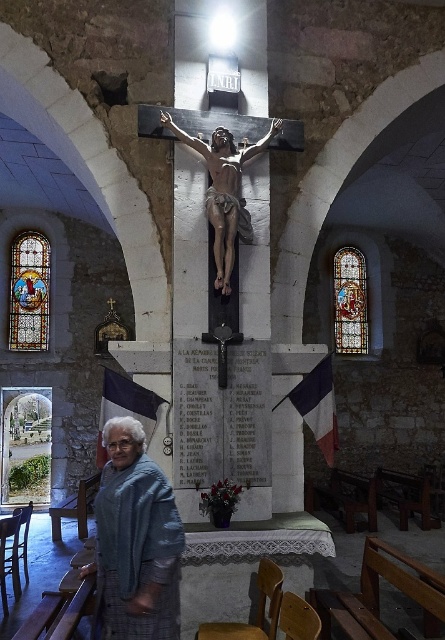
You are standing in the church and want to place a small bouquet of flowers at the base of the cross. The church has a strict rule that items must be placed at least 1 meter away from any personal items. The blue plaid shawl at lower left is the closest personal item. Can you place the bouquet at the base of the cross?

The blue plaid shawl at lower left is located at point (134, 541). The distance between the base of the cross and the shawl must be calculated to ensure compliance with the 1 meter rule. However, without knowing the exact dimensions of the church or the coordinates of the cross base, it is impossible to determine if the bouquet can be placed there.

You are an interior designer planning to place a new sculpture in the church. The sculpture requires a space wider than the stained glass window at left. Can the area where the matte stone crucifix at center is placed accommodate the sculpture?

The matte stone crucifix at center is wider than the stained glass window at left. Since the sculpture requires a space wider than the stained glass window at left, the area where the matte stone crucifix at center is placed can accommodate the sculpture as it has sufficient width.